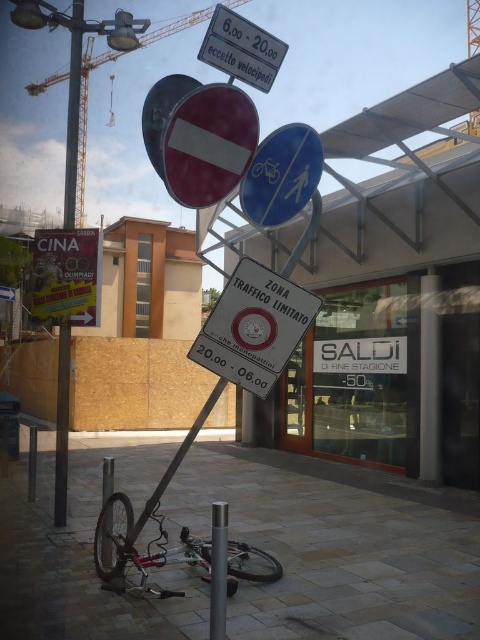
Question: Which is farther from the brushed metal crane at upper left?

Choices:
 (A) yellow paper poster at center
 (B) white plastic sign at upper center
 (C) metallic silver sign at center

Answer: (B)

Question: Can you confirm if metallic silver sign at center is thinner than blue plastic bicycle and pedestrian sign at center?

Choices:
 (A) yes
 (B) no

Answer: (B)

Question: Which point is closer to the camera?

Choices:
 (A) (334, 609)
 (B) (83, 99)

Answer: (A)

Question: Which object appears farthest from the camera in this image?

Choices:
 (A) white plastic sign at upper center
 (B) silver metallic bicycle at center

Answer: (B)

Question: Is metallic silver sign at center thinner than yellow paper poster at center?

Choices:
 (A) no
 (B) yes

Answer: (A)

Question: Is metallic silver sign at center wider than brushed metal crane at upper left?

Choices:
 (A) no
 (B) yes

Answer: (A)